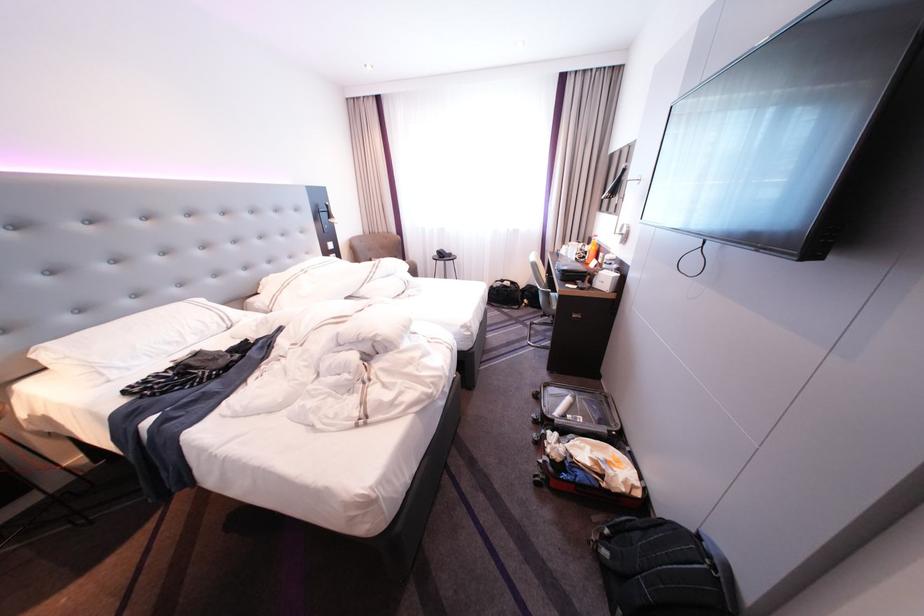
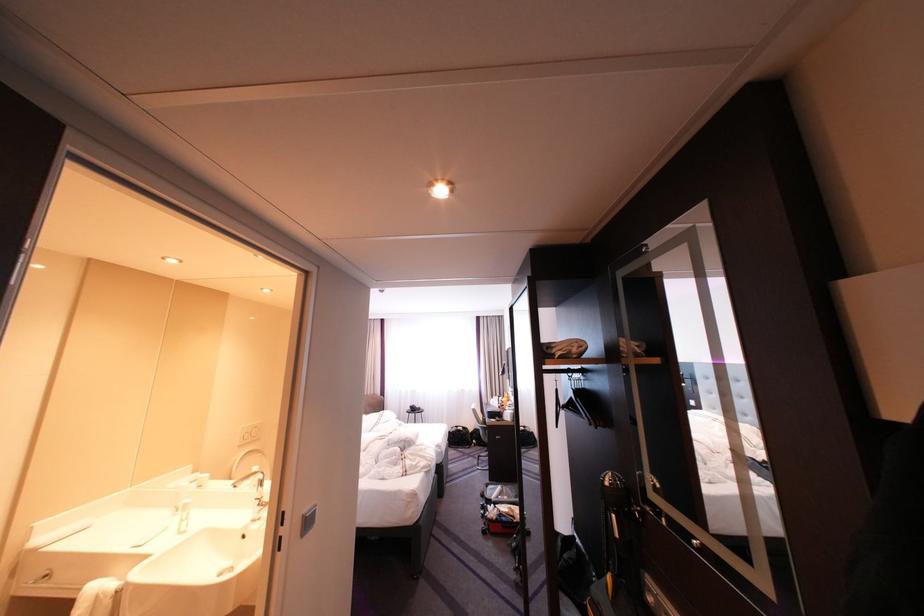
In the second image, find the point that corresponds to pixel 511 286 in the first image.

(467, 431)